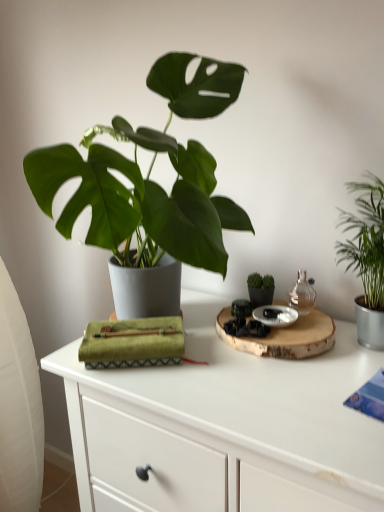
Identify the location of vacant region in front of matte black pot at center. This screenshot has width=384, height=512. (274, 364).